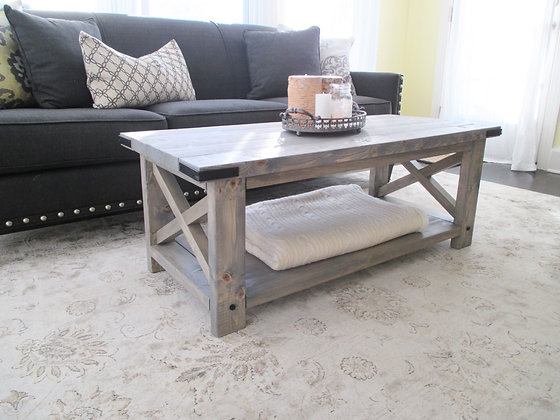
This screenshot has width=560, height=420. I want to click on handrest, so click(x=390, y=82).